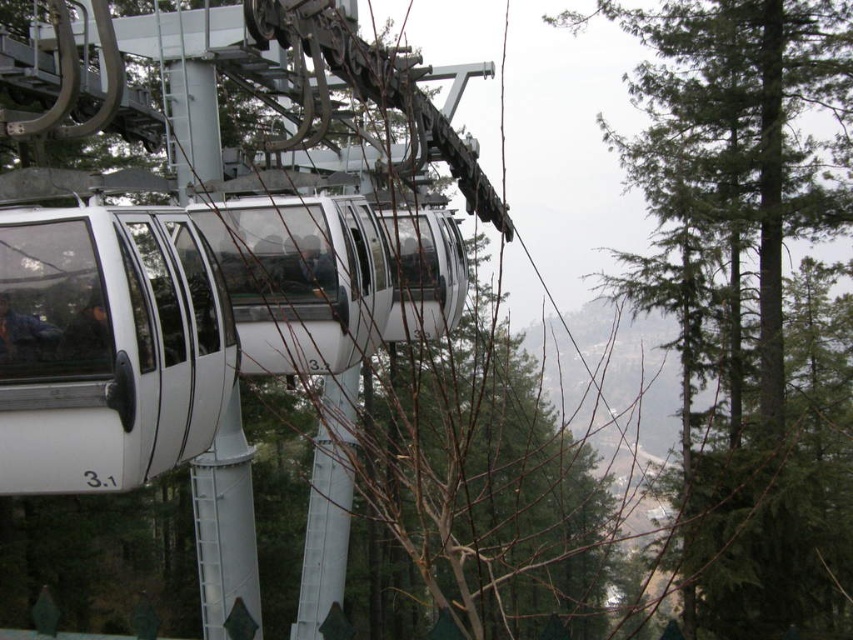
You are a photographer trying to capture a shot of the white glossy cable car at center and the bare branches at center. From your current position, which object is closer to the left side of the frame?

The white glossy cable car at center is positioned on the left side of the bare branches at center, so it is closer to the left side of the frame.

You are a photographer planning to take a picture of the cable car system. You want to ensure both the green textured tree at upper right and the bare branches at center are in focus. Which object should you focus on first to ensure depth of field covers both?

The green textured tree at upper right is thinner than the bare branches at center. To ensure both are in focus, focus on the bare branches at center since it is the thicker object, providing a larger depth of field coverage for the thinner green textured tree at upper right.

You are a photographer trying to capture a shot of the white glossy cable car at center and the green textured tree at upper right. Which object should you zoom in on to ensure both are in focus without adjusting your camera settings?

The green textured tree at upper right is bigger than the white glossy cable car at center, so you should zoom in on the green textured tree at upper right to ensure both are in focus.